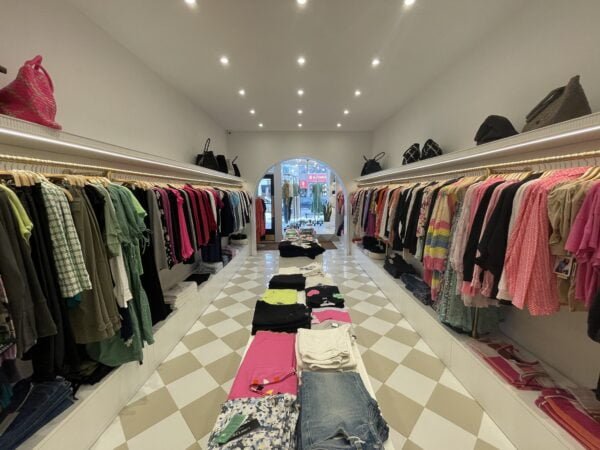
At what (x,y) coordinates should I click in order to perform the action: click on the left wall. Please return your answer as a coordinate pair (x, y). Looking at the image, I should click on (153, 112).